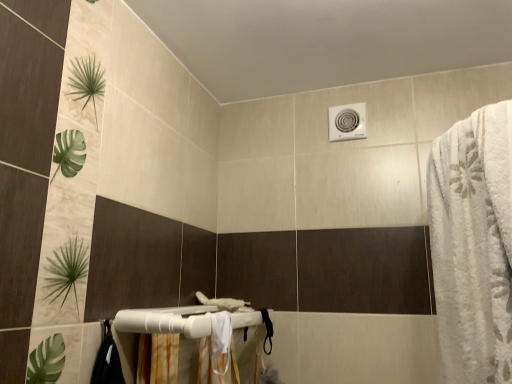
At what (x,y) coordinates should I click in order to perform the action: click on white fluffy bath towel at right. Please return your answer as a coordinate pair (x, y). The width and height of the screenshot is (512, 384). Looking at the image, I should click on (473, 245).

I want to click on white fabric shower curtain at lower center, so click(218, 352).

Does white fabric shower curtain at lower center appear on the right side of white plastic towel bar at lower center?

Yes.

Between white fabric shower curtain at lower center and white plastic towel bar at lower center, which one has larger size?

white plastic towel bar at lower center is bigger.

From the image's perspective, is white fabric shower curtain at lower center located beneath white plastic towel bar at lower center?

Yes, from the image's perspective, white fabric shower curtain at lower center is beneath white plastic towel bar at lower center.

From a real-world perspective, which object stands above the other?

white plastic towel bar at lower center, from a real-world perspective.

From the image's perspective, between white plastic towel bar at lower center and white fabric shower curtain at lower center, who is located below?

white fabric shower curtain at lower center, from the image's perspective.

Would you say white plastic towel bar at lower center is to the left or to the right of white fabric shower curtain at lower center in the picture?

Based on their positions, white plastic towel bar at lower center is located to the left of white fabric shower curtain at lower center.

Between white plastic towel bar at lower center and white fabric shower curtain at lower center, which one has larger width?

With larger width is white plastic towel bar at lower center.

Locate an element on the screen. The width and height of the screenshot is (512, 384). shower curtain that appears on the right of white plastic towel bar at lower center is located at coordinates (218, 352).

Is white plastic towel bar at lower center at the back of white fluffy bath towel at right?

No, white fluffy bath towel at right is not facing away from white plastic towel bar at lower center.

How distant is white fluffy bath towel at right from white plastic towel bar at lower center?

The distance of white fluffy bath towel at right from white plastic towel bar at lower center is 28.46 inches.

From the image's perspective, is white fluffy bath towel at right positioned above or below white plastic towel bar at lower center?

Clearly, from the image's perspective, white fluffy bath towel at right is above white plastic towel bar at lower center.

From a real-world perspective, who is located lower, white fluffy bath towel at right or white plastic towel bar at lower center?

white plastic towel bar at lower center.

Between white fabric shower curtain at lower center and white fluffy bath towel at right, which one appears on the left side from the viewer's perspective?

white fabric shower curtain at lower center is more to the left.

You are a GUI agent. You are given a task and a screenshot of the screen. Output one action in this format:
    pyautogui.click(x=<x>, y=<y>)
    Task: Click on the shower curtain below the white fluffy bath towel at right (from the image's perspective)
    Image resolution: width=512 pixels, height=384 pixels.
    Given the screenshot: What is the action you would take?
    pyautogui.click(x=218, y=352)

Considering the relative sizes of white fabric shower curtain at lower center and white fluffy bath towel at right in the image provided, is white fabric shower curtain at lower center shorter than white fluffy bath towel at right?

Yes.

Does white fabric shower curtain at lower center have a greater width compared to white fluffy bath towel at right?

No.

Does white fluffy bath towel at right have a lesser height compared to white fabric shower curtain at lower center?

Incorrect, the height of white fluffy bath towel at right does not fall short of that of white fabric shower curtain at lower center.

How many degrees apart are the facing directions of white fluffy bath towel at right and white fabric shower curtain at lower center?

They differ by 180 degrees in their facing directions.

Could you tell me if white fluffy bath towel at right is turned towards white fabric shower curtain at lower center?

Yes, white fluffy bath towel at right faces towards white fabric shower curtain at lower center.

Can you tell me how much white plastic towel bar at lower center and white fluffy bath towel at right differ in facing direction?

The angle between the facing direction of white plastic towel bar at lower center and the facing direction of white fluffy bath towel at right is 180 degrees.

Between white plastic towel bar at lower center and white fluffy bath towel at right, which one has more height?

white fluffy bath towel at right is taller.

Does white plastic towel bar at lower center lie behind white fluffy bath towel at right?

That is True.

Would you consider white plastic towel bar at lower center to be distant from white fluffy bath towel at right?

No, white plastic towel bar at lower center is in close proximity to white fluffy bath towel at right.

Where is `towel bar located above the white fabric shower curtain at lower center (from a real-world perspective)`? towel bar located above the white fabric shower curtain at lower center (from a real-world perspective) is located at coordinates (166, 320).

Image resolution: width=512 pixels, height=384 pixels. In order to click on shower curtain that appears on the right of white plastic towel bar at lower center in this screenshot , I will do `click(218, 352)`.

Considering their positions, is white fabric shower curtain at lower center positioned closer to white fluffy bath towel at right than white plastic towel bar at lower center?

white fabric shower curtain at lower center.

Looking at the image, which one is located further to white plastic towel bar at lower center, white fabric shower curtain at lower center or white fluffy bath towel at right?

white fluffy bath towel at right is further to white plastic towel bar at lower center.

Based on their spatial positions, is white fluffy bath towel at right or white plastic towel bar at lower center further from white fabric shower curtain at lower center?

white fluffy bath towel at right.

Which object lies further to the anchor point white fluffy bath towel at right, white plastic towel bar at lower center or white fabric shower curtain at lower center?

white plastic towel bar at lower center lies further to white fluffy bath towel at right than the other object.

Considering their positions, is white fluffy bath towel at right positioned further to white plastic towel bar at lower center than white fabric shower curtain at lower center?

The object further to white plastic towel bar at lower center is white fluffy bath towel at right.

Based on their spatial positions, is white plastic towel bar at lower center or white fluffy bath towel at right further from white fabric shower curtain at lower center?

white fluffy bath towel at right.

This screenshot has width=512, height=384. I want to click on shower curtain between white plastic towel bar at lower center and white fluffy bath towel at right from left to right, so click(x=218, y=352).